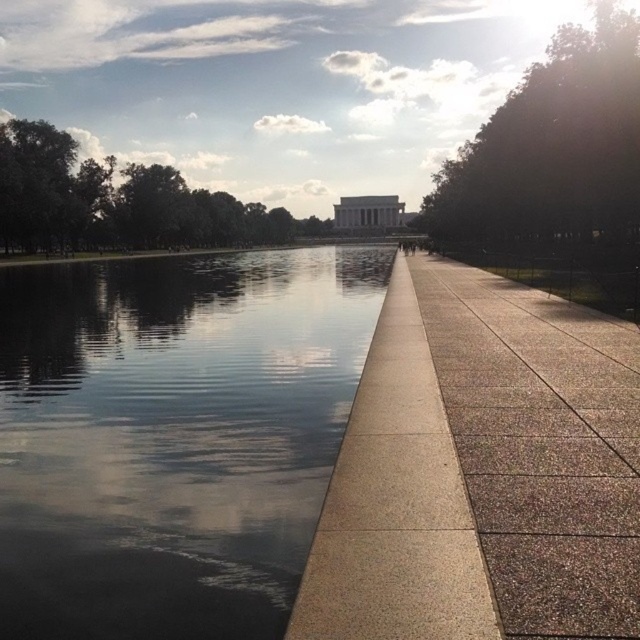
Question: Can you confirm if sanded concrete pavement at center is positioned to the left of green leafy trees at left?

Choices:
 (A) no
 (B) yes

Answer: (A)

Question: Which point is closer to the camera?

Choices:
 (A) green leafy tree at upper right
 (B) sanded concrete pavement at center
 (C) glossy reflective water at center
 (D) green leafy trees at left

Answer: (B)

Question: Is green leafy tree at upper right to the left of green leafy trees at left from the viewer's perspective?

Choices:
 (A) no
 (B) yes

Answer: (A)

Question: Estimate the real-world distances between objects in this image. Which object is farther from the green leafy trees at left?

Choices:
 (A) sanded concrete pavement at center
 (B) green leafy tree at upper right
 (C) glossy reflective water at center

Answer: (A)

Question: Which point is closer to the camera?

Choices:
 (A) green leafy tree at upper right
 (B) glossy reflective water at center
 (C) sanded concrete pavement at center
 (D) green leafy trees at left

Answer: (C)

Question: Can you confirm if sanded concrete pavement at center is thinner than green leafy trees at left?

Choices:
 (A) yes
 (B) no

Answer: (A)